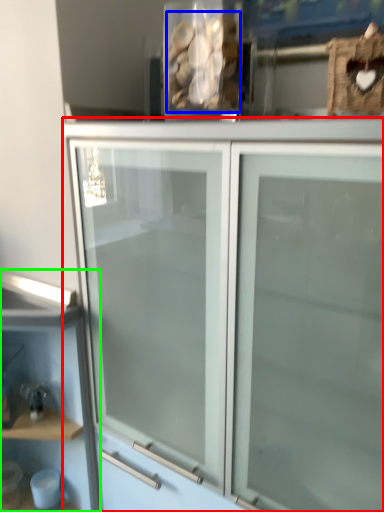
Question: Based on their relative distances, which object is farther from cupboard (highlighted by a red box)? Choose from stuff (highlighted by a blue box) and shelf (highlighted by a green box).

Choices:
 (A) stuff
 (B) shelf

Answer: (A)